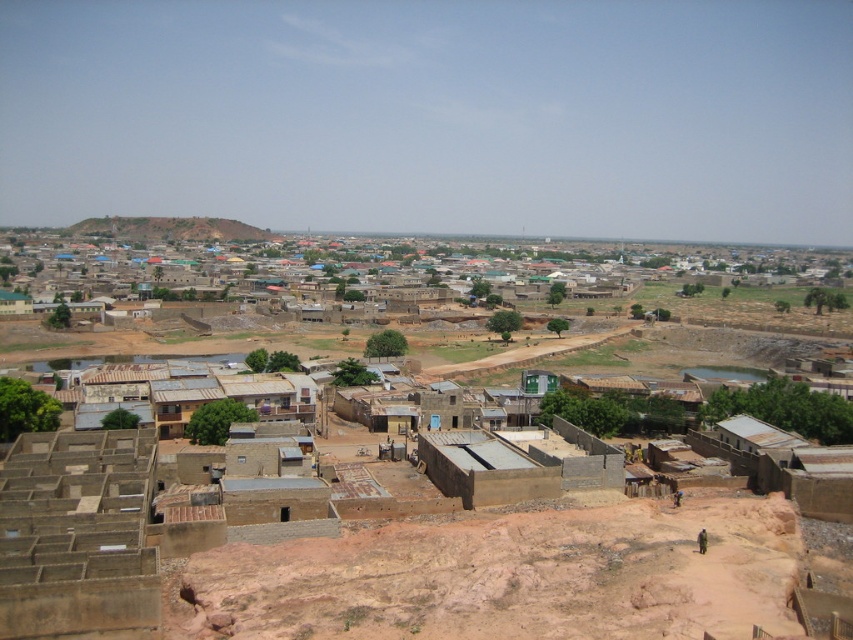
Measure the distance between brown sandy dirt field at lower center and camera.

The distance of brown sandy dirt field at lower center from camera is 162.10 feet.

Is point (387, 577) behind point (97, 227)?

No, it is in front of (97, 227).

Does point (534, 588) come farther from viewer compared to point (160, 236)?

No, (534, 588) is in front of (160, 236).

The height and width of the screenshot is (640, 853). I want to click on brown sandy dirt field at lower center, so 505,577.

Is brown concrete hut at center wider than brown earthy hillside at upper left?

In fact, brown concrete hut at center might be narrower than brown earthy hillside at upper left.

Is brown concrete hut at center to the right of brown earthy hillside at upper left from the viewer's perspective?

Indeed, brown concrete hut at center is positioned on the right side of brown earthy hillside at upper left.

Locate an element on the screen. This screenshot has height=640, width=853. brown concrete hut at center is located at coordinates (485, 468).

Find the location of `brown concrete hut at center`. brown concrete hut at center is located at coordinates (485, 468).

Is brown sandy dirt field at lower center wider than brown concrete hut at center?

Indeed, brown sandy dirt field at lower center has a greater width compared to brown concrete hut at center.

Which is more to the right, brown sandy dirt field at lower center or brown concrete hut at center?

brown sandy dirt field at lower center

Which is behind, point (523, 616) or point (445, 432)?

Point (445, 432)

Identify the location of brown sandy dirt field at lower center. The height and width of the screenshot is (640, 853). (505, 577).